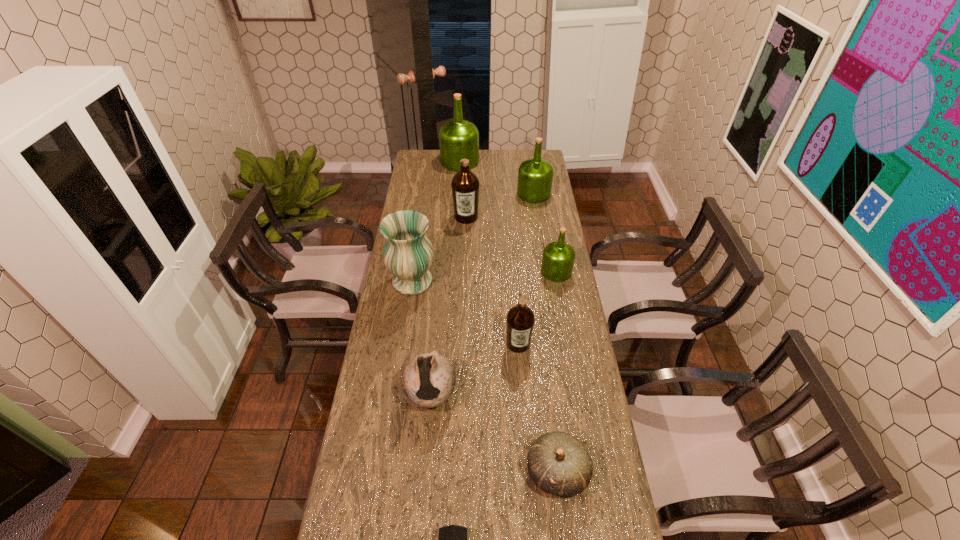
I want to click on the second nearest olive oil, so click(x=558, y=258).

Locate an element on the screen. pottery is located at coordinates (428, 380).

This screenshot has height=540, width=960. I want to click on the eighth farthest object, so click(558, 463).

Where is `the eighth tallest object`? the eighth tallest object is located at coordinates coord(558,463).

Where is `vacant space located on the front of the biggest green olive oil`? The width and height of the screenshot is (960, 540). vacant space located on the front of the biggest green olive oil is located at coordinates (458, 190).

At what (x,y) coordinates should I click in order to perform the action: click on vacant point located on the front of the second smallest green olive oil. Please return your answer as a coordinate pair (x, y). The width and height of the screenshot is (960, 540). Looking at the image, I should click on (542, 252).

Locate an element on the screen. This screenshot has height=540, width=960. vacant point located 0.300m on the label of the bigger brown olive oil is located at coordinates (465, 270).

Find the location of `free space located 0.180m on the right of the green vase`. free space located 0.180m on the right of the green vase is located at coordinates (481, 281).

Locate an element on the screen. The image size is (960, 540). vacant space located 0.120m on the label of the sixth farthest object is located at coordinates (521, 385).

Identify the location of vacant space located on the left of the smallest green olive oil. (444, 272).